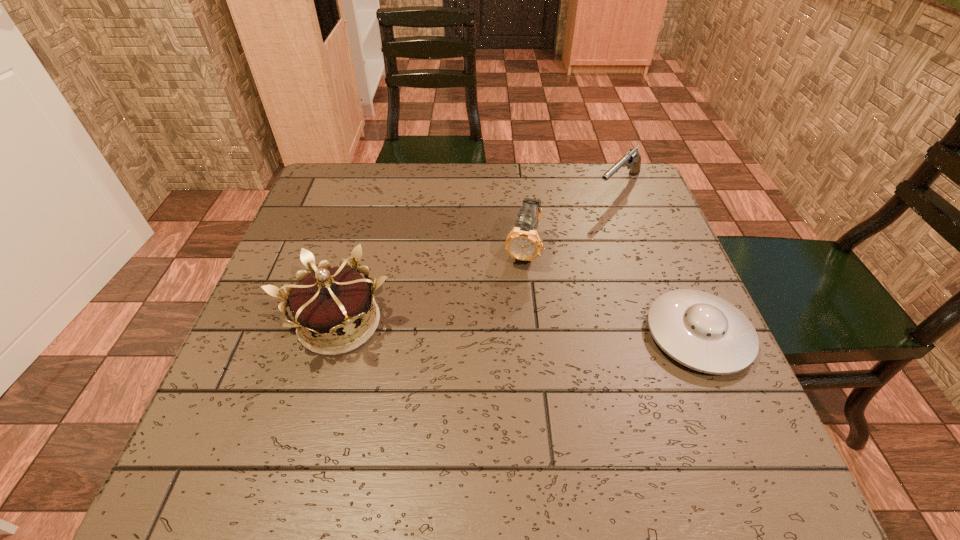
This screenshot has width=960, height=540. I want to click on object positioned at the near right corner, so click(701, 331).

Identify the location of vacant space at the far edge of the desktop. This screenshot has height=540, width=960. (505, 200).

The height and width of the screenshot is (540, 960). I want to click on vacant space at the near edge of the desktop, so click(380, 402).

This screenshot has height=540, width=960. I want to click on vacant space at the left edge of the desktop, so click(276, 349).

In the image, there is a desktop. Where is `vacant space at the right edge`? The height and width of the screenshot is (540, 960). vacant space at the right edge is located at coordinates (638, 280).

Locate an element on the screen. This screenshot has width=960, height=540. vacant space at the far left corner of the desktop is located at coordinates (314, 201).

What are the coordinates of `vacant area at the far right corner` in the screenshot? It's located at (605, 209).

This screenshot has height=540, width=960. In order to click on vacant space at the near right corner of the desktop in this screenshot , I will do `click(737, 412)`.

This screenshot has width=960, height=540. Find the location of `empty space between the shortest object and the crown`. empty space between the shortest object and the crown is located at coordinates (518, 329).

I want to click on unoccupied area between the leftmost object and the watch, so click(x=431, y=287).